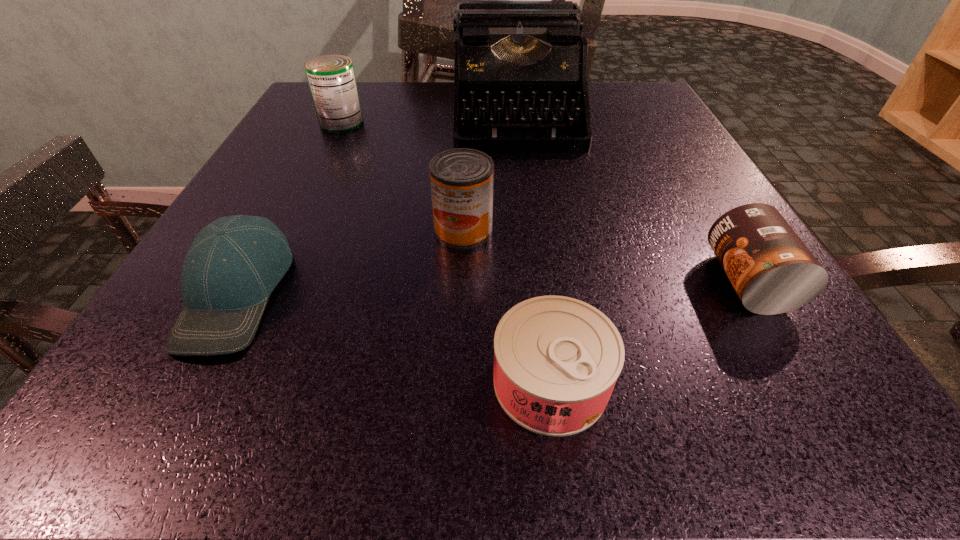
At what (x,y) coordinates should I click in order to perform the action: click on vacant area that lies between the rightmost object and the second farthest can. Please return your answer as a coordinate pair (x, y). Looking at the image, I should click on (606, 256).

Find the location of a particular element. The image size is (960, 540). empty space between the farthest can and the baseball cap is located at coordinates (289, 208).

Where is `vacant space that's between the rightmost object and the second farthest can`? The height and width of the screenshot is (540, 960). vacant space that's between the rightmost object and the second farthest can is located at coordinates (606, 256).

Where is `empty space between the baseball cap and the second shortest can`? This screenshot has width=960, height=540. empty space between the baseball cap and the second shortest can is located at coordinates (492, 287).

Where is `free area in between the farthest can and the tallest object`? Image resolution: width=960 pixels, height=540 pixels. free area in between the farthest can and the tallest object is located at coordinates (428, 118).

I want to click on vacant area that lies between the typewriter and the shortest can, so click(533, 247).

This screenshot has width=960, height=540. I want to click on free space between the baseball cap and the typewriter, so click(x=375, y=203).

Identify the location of vacant area that lies between the nearest can and the rightmost object. (649, 332).

Image resolution: width=960 pixels, height=540 pixels. In order to click on the closest object relative to the second nearest can in this screenshot , I will do `click(556, 359)`.

You are a GUI agent. You are given a task and a screenshot of the screen. Output one action in this format:
    pyautogui.click(x=<x>, y=<y>)
    Task: Click on the object that is the closest one to the typewriter
    
    Given the screenshot: What is the action you would take?
    pyautogui.click(x=331, y=78)